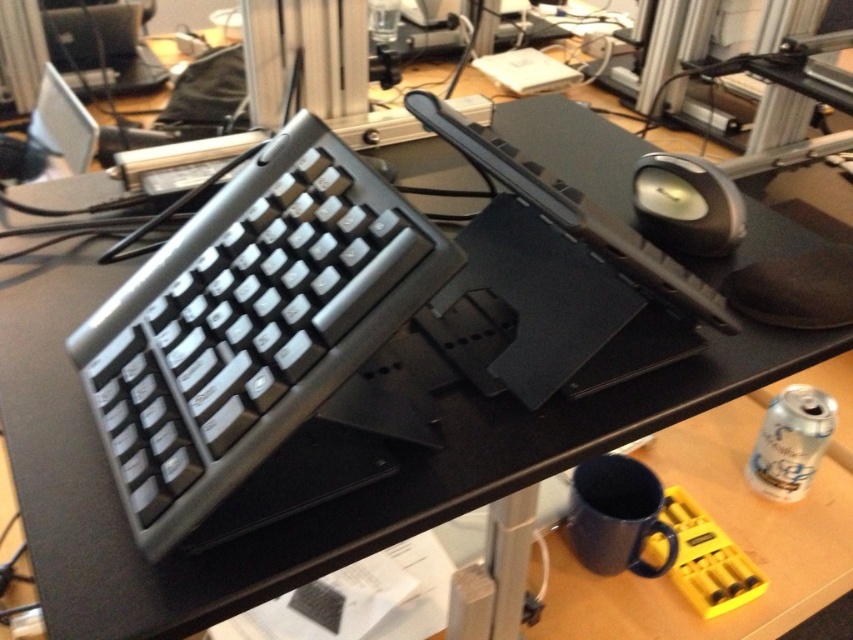
Question: Is silver metallic keyboard at left positioned in front of black rubber mouse at upper right?

Choices:
 (A) yes
 (B) no

Answer: (A)

Question: Is the position of silver metallic keyboard at left less distant than that of black rubber mouse at upper right?

Choices:
 (A) no
 (B) yes

Answer: (B)

Question: Is silver metallic keyboard at left closer to camera compared to black rubber mouse at upper right?

Choices:
 (A) yes
 (B) no

Answer: (A)

Question: Among these objects, which one is nearest to the camera?

Choices:
 (A) silver metallic keyboard at left
 (B) black rubber mouse at upper right

Answer: (A)